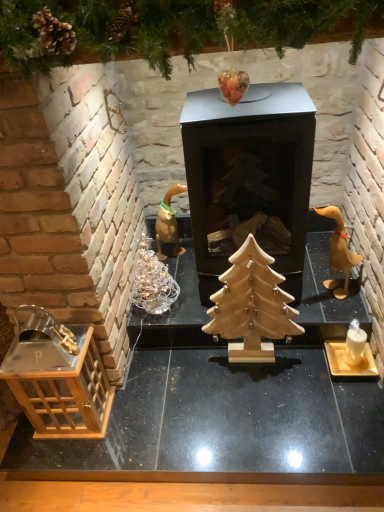
This screenshot has width=384, height=512. What do you see at coordinates (222, 415) in the screenshot?
I see `wooden table at lower left` at bounding box center [222, 415].

The width and height of the screenshot is (384, 512). What are the coordinates of `wooden christmas tree at upper center` in the screenshot? It's located at (170, 29).

In order to click on transparent glass lantern at lower left in this screenshot , I will do `click(60, 387)`.

You are a GUI agent. You are given a task and a screenshot of the screen. Output one action in this format:
    pyautogui.click(x=<x>, y=<y>)
    Task: Click on the wooden duckling at right
    
    Given the screenshot: What is the action you would take?
    pyautogui.click(x=339, y=251)

Image resolution: width=384 pixels, height=512 pixels. Identify the location of natural wood christmas tree at center. (x=252, y=306).

From the image's perspective, is metallic black fireplace at center over wooden christmas tree at upper center?

Incorrect, from the image's perspective, metallic black fireplace at center is lower than wooden christmas tree at upper center.

In the image, there is a wooden christmas tree at upper center. In order to click on fireplace below it (from a real-world perspective) in this screenshot , I will do `click(249, 175)`.

Is metallic black fireplace at center outside of wooden christmas tree at upper center?

That's correct, metallic black fireplace at center is outside of wooden christmas tree at upper center.

Can you confirm if metallic black fireplace at center is wider than wooden christmas tree at upper center?

Yes, metallic black fireplace at center is wider than wooden christmas tree at upper center.

From the image's perspective, is transparent glass lantern at lower left located beneath wooden table at lower left?

Actually, transparent glass lantern at lower left appears above wooden table at lower left in the image.

Could you tell me if transparent glass lantern at lower left is facing wooden table at lower left?

No, transparent glass lantern at lower left is not oriented towards wooden table at lower left.

Who is taller, transparent glass lantern at lower left or wooden table at lower left?

With more height is transparent glass lantern at lower left.

In the scene shown: Is transparent glass lantern at lower left with wooden table at lower left?

No, transparent glass lantern at lower left is not making contact with wooden table at lower left.

Is wooden table at lower left next to natural wood christmas tree at center?

wooden table at lower left and natural wood christmas tree at center are clearly separated.

Is wooden table at lower left facing towards natural wood christmas tree at center?

No, wooden table at lower left does not turn towards natural wood christmas tree at center.

Is wooden table at lower left completely or partially outside of natural wood christmas tree at center?

wooden table at lower left lies outside natural wood christmas tree at center's area.

From a real-world perspective, which object stands above the other?

wooden duckling at right is physically above.

From the picture: Is natural wood christmas tree at center in front of or behind wooden duckling at right in the image?

In the image, natural wood christmas tree at center appears in front of wooden duckling at right.

Considering the relative positions of natural wood christmas tree at center and wooden duckling at right in the image provided, is natural wood christmas tree at center to the right of wooden duckling at right from the viewer's perspective?

No, natural wood christmas tree at center is not to the right of wooden duckling at right.

Would you consider natural wood christmas tree at center to be distant from wooden duckling at right?

No.

Is wooden table at lower left at the left side of wooden christmas tree at upper center?

In fact, wooden table at lower left is to the right of wooden christmas tree at upper center.

Can you tell me how much wooden table at lower left and wooden christmas tree at upper center differ in facing direction?

wooden table at lower left and wooden christmas tree at upper center are facing 0.00167 degrees away from each other.

Does wooden table at lower left have a greater width compared to wooden christmas tree at upper center?

Indeed, wooden table at lower left has a greater width compared to wooden christmas tree at upper center.

Do you think wooden table at lower left is within wooden christmas tree at upper center, or outside of it?

wooden table at lower left lies outside wooden christmas tree at upper center.

Can you confirm if wooden christmas tree at upper center is thinner than wooden table at lower left?

Yes, wooden christmas tree at upper center is thinner than wooden table at lower left.

The image size is (384, 512). What are the coordinates of `tree located above the wooden table at lower left (from a real-world perspective)` in the screenshot? It's located at (170, 29).

Considering the sizes of objects wooden christmas tree at upper center and wooden table at lower left in the image provided, who is taller, wooden christmas tree at upper center or wooden table at lower left?

Standing taller between the two is wooden table at lower left.

From the image's perspective, which is above, wooden christmas tree at upper center or wooden table at lower left?

wooden christmas tree at upper center.

Is metallic black fireplace at center wider than natural wood christmas tree at center?

Yes.

Which point is more distant from viewer, (299, 220) or (255, 268)?

Positioned behind is point (299, 220).

Can you confirm if metallic black fireplace at center is positioned to the left of natural wood christmas tree at center?

Indeed, metallic black fireplace at center is positioned on the left side of natural wood christmas tree at center.

In the scene shown: Is metallic black fireplace at center beside natural wood christmas tree at center?

metallic black fireplace at center is not next to natural wood christmas tree at center, and they're not touching.

Locate an element on the screen. Image resolution: width=384 pixels, height=512 pixels. fireplace located below the wooden christmas tree at upper center (from the image's perspective) is located at coordinates (249, 175).

This screenshot has width=384, height=512. What are the coordinates of `crate that is above the wooden table at lower left (from the image's perspective)` in the screenshot? It's located at (60, 387).

When comparing their distances from transparent glass lantern at lower left, does metallic black fireplace at center or wooden christmas tree at upper center seem closer?

metallic black fireplace at center is closer to transparent glass lantern at lower left.

Based on the photo, considering their positions, is metallic black fireplace at center positioned further to wooden christmas tree at upper center than wooden duckling at right?

wooden duckling at right lies further to wooden christmas tree at upper center than the other object.

Based on their spatial positions, is matte gold candle holder at lower right or natural wood christmas tree at center closer to transparent glass lantern at lower left?

The object closer to transparent glass lantern at lower left is natural wood christmas tree at center.

From the image, which object appears to be nearer to transparent glass lantern at lower left, wooden duckling at right or wooden christmas tree at upper center?

The object closer to transparent glass lantern at lower left is wooden christmas tree at upper center.

From the image, which object appears to be nearer to transparent glass lantern at lower left, wooden table at lower left or wooden christmas tree at upper center?

wooden table at lower left is positioned closer to the anchor transparent glass lantern at lower left.

Considering their positions, is natural wood christmas tree at center positioned further to metallic black fireplace at center than matte gold candle holder at lower right?

Among the two, matte gold candle holder at lower right is located further to metallic black fireplace at center.

Which object lies nearer to the anchor point wooden christmas tree at upper center, matte gold candle holder at lower right or natural wood christmas tree at center?

Based on the image, natural wood christmas tree at center appears to be nearer to wooden christmas tree at upper center.

Looking at the image, which one is located closer to wooden christmas tree at upper center, metallic black fireplace at center or wooden table at lower left?

metallic black fireplace at center.

I want to click on christmas tree between wooden duckling at right and wooden table at lower left vertically, so click(x=252, y=306).

The height and width of the screenshot is (512, 384). Identify the location of fireplace between transparent glass lantern at lower left and wooden duckling at right from left to right. (249, 175).

Locate an element on the screen. Image resolution: width=384 pixels, height=512 pixels. christmas tree located between wooden table at lower left and matte gold candle holder at lower right in the left-right direction is located at coordinates (252, 306).

Identify the location of candle holder that lies between wooden christmas tree at upper center and wooden table at lower left from top to bottom. The width and height of the screenshot is (384, 512). (351, 355).